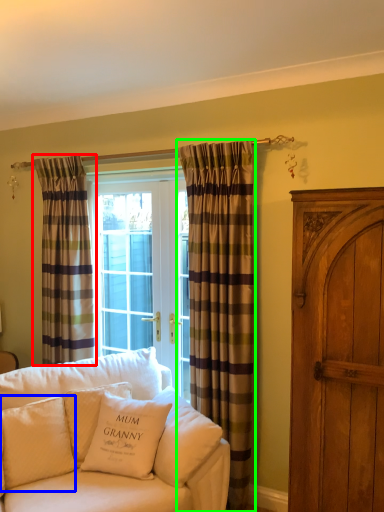
Question: Which is nearer to the curtain (highlighted by a red box)? pillow (highlighted by a blue box) or curtain (highlighted by a green box).

Choices:
 (A) pillow
 (B) curtain

Answer: (A)